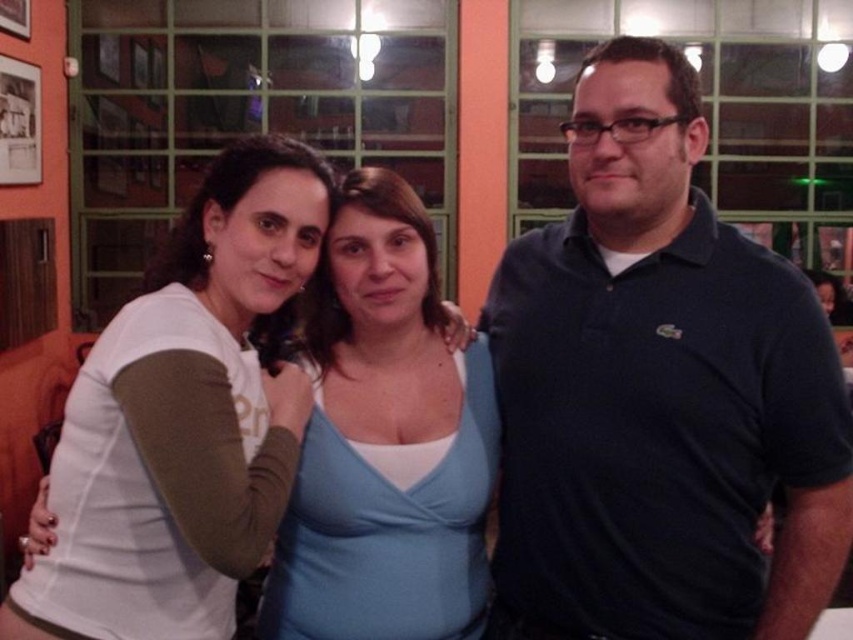
You are at a social event and want to hand a drink to the person wearing the dark blue polo shirt at center. Based on their position, where should you approach from?

The dark blue polo shirt at center is located at point 0.614 on the x axis and 0.773 on the y axis, so you should approach from the left side to reach them.

You are a photographer at the event and need to adjust the camera focus. Since the light blue fabric top at center and the white matte shirt at upper left are in the frame, which one should you focus on to ensure proper exposure if the top is much taller?

The light blue fabric top at center should be focused on for proper exposure because it is much taller than the white matte shirt at upper left, making it a more prominent subject in the frame.